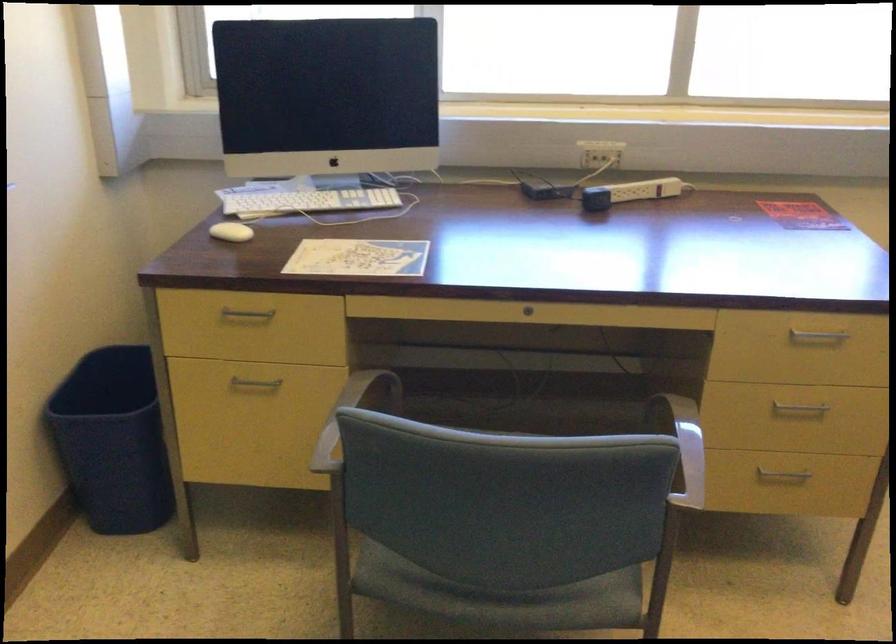
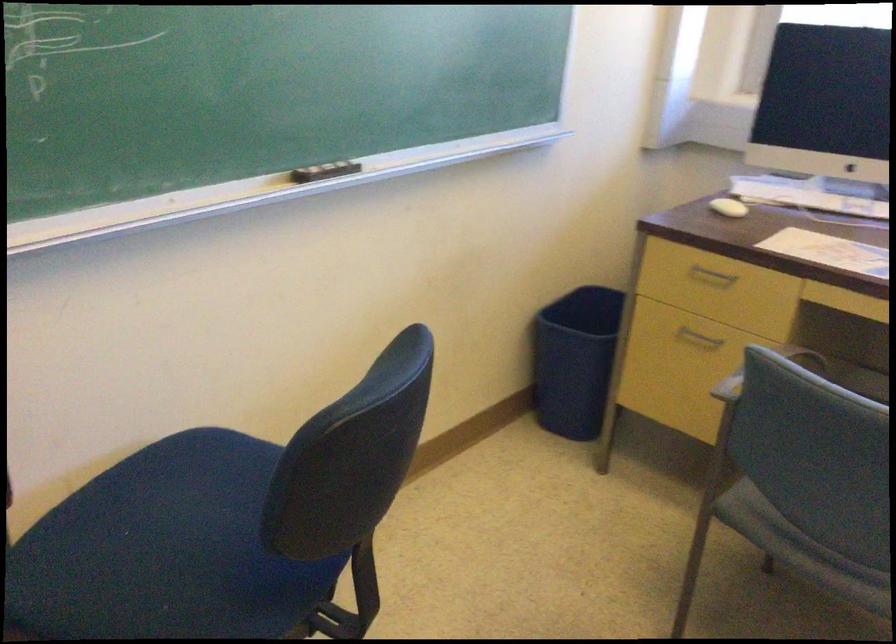
Find the pixel in the second image that matches point (113, 456) in the first image.

(574, 360)